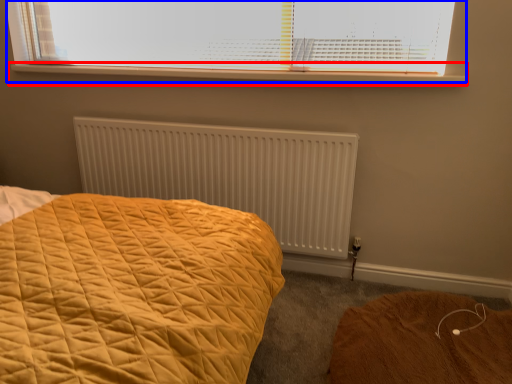
Question: Among these objects, which one is nearest to the camera, window sill (highlighted by a red box) or window (highlighted by a blue box)?

Choices:
 (A) window sill
 (B) window

Answer: (B)